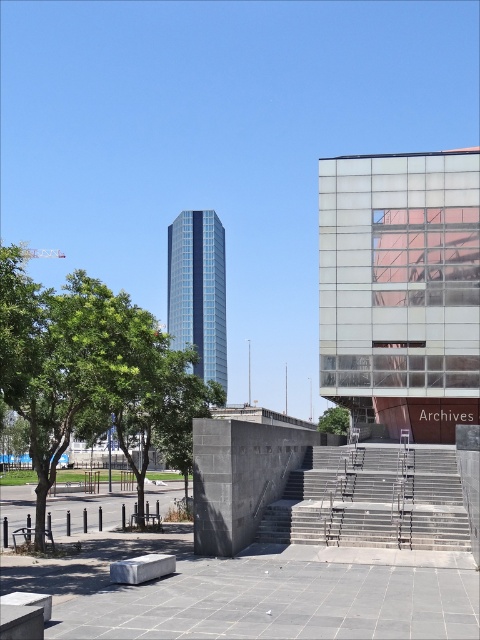
You are a city planner assessing the skyline. You notice the glassy reflective building at upper right and the glassy blue skyscraper at center. Which one appears to be the larger structure?

The glassy blue skyscraper at center is larger than the glassy reflective building at upper right.

You are a drone operator who needs to position your drone to capture a photo of the glassy reflective building at upper right. The drone must stay within the city limits shown in the image. Can you confirm if the building is within the city limits based on its coordinates?

The glassy reflective building at upper right is located at coordinates point (400, 289), which falls within the city limits as depicted in the image.

You are a drone operator planning to fly a drone from the lower left corner of the image to the glassy reflective building at upper right. According to the coordinates provided, what is the direction you should fly the drone to reach the building?

The glassy reflective building at upper right is located at coordinates point [400,289]. Since the drone is starting from the lower left corner, it should fly northeast to reach the building.